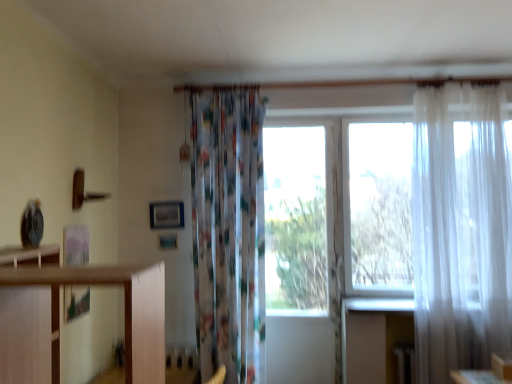
The image size is (512, 384). I want to click on transparent white curtain at right, so click(377, 208).

What do you see at coordinates (377, 208) in the screenshot?
I see `transparent white curtain at right` at bounding box center [377, 208].

Where is `printed fabric curtain at center, arranged as the 1th curtain when viewed from the left`? The height and width of the screenshot is (384, 512). printed fabric curtain at center, arranged as the 1th curtain when viewed from the left is located at coordinates coord(228,229).

The height and width of the screenshot is (384, 512). Identify the location of wooden shelf at left. (124, 308).

Image resolution: width=512 pixels, height=384 pixels. I want to click on transparent glass window at center, so click(295, 219).

I want to click on translucent white curtain at right, which is the 2th curtain from left to right, so click(460, 232).

Is transparent white curtain at right facing away from translucent white curtain at right, which is the 2th curtain from left to right?

Absolutely, transparent white curtain at right is directed away from translucent white curtain at right, which is the 2th curtain from left to right.

Does transparent white curtain at right have a larger size compared to translucent white curtain at right, the 1th curtain when ordered from right to left?

Actually, transparent white curtain at right might be smaller than translucent white curtain at right, the 1th curtain when ordered from right to left.

From the image's perspective, starting from the transparent white curtain at right, which curtain is the 1st one below? Please provide its 2D coordinates.

[(460, 232)]

Would you say wooden shelf at left is to the left or to the right of transparent white curtain at right in the picture?

Clearly, wooden shelf at left is on the left of transparent white curtain at right in the image.

Which of these two, wooden shelf at left or transparent white curtain at right, stands shorter?

wooden shelf at left.

Is wooden shelf at left surrounding transparent white curtain at right?

That's incorrect, transparent white curtain at right is not inside wooden shelf at left.

Can you confirm if wooden shelf at left is wider than transparent white curtain at right?

Indeed, wooden shelf at left has a greater width compared to transparent white curtain at right.

Can we say transparent white curtain at right lies outside printed fabric curtain at center, the second curtain positioned from the right?

That's correct, transparent white curtain at right is outside of printed fabric curtain at center, the second curtain positioned from the right.

From the image's perspective, is transparent white curtain at right over printed fabric curtain at center, the second curtain positioned from the right?

Yes, from the image's perspective, transparent white curtain at right is over printed fabric curtain at center, the second curtain positioned from the right.

What's the angular difference between transparent white curtain at right and printed fabric curtain at center, the second curtain positioned from the right,'s facing directions?

They differ by 1.27 degrees in their facing directions.

Does transparent white curtain at right turn towards printed fabric curtain at center, the second curtain positioned from the right?

No, transparent white curtain at right is not oriented towards printed fabric curtain at center, the second curtain positioned from the right.

Is the depth of printed fabric curtain at center, arranged as the 1th curtain when viewed from the left, less than that of wooden shelf at left?

No, the depth of printed fabric curtain at center, arranged as the 1th curtain when viewed from the left, is greater than that of wooden shelf at left.

Is wooden shelf at left inside printed fabric curtain at center, the second curtain positioned from the right?

No, printed fabric curtain at center, the second curtain positioned from the right, does not contain wooden shelf at left.

From a real-world perspective, is printed fabric curtain at center, arranged as the 1th curtain when viewed from the left, on top of wooden shelf at left?

Yes.

Between printed fabric curtain at center, arranged as the 1th curtain when viewed from the left, and wooden shelf at left, which one has larger size?

With larger size is wooden shelf at left.

Can you confirm if translucent white curtain at right, which is the 2th curtain from left to right, is shorter than transparent white curtain at right?

No, translucent white curtain at right, which is the 2th curtain from left to right, is not shorter than transparent white curtain at right.

Looking at this image, is translucent white curtain at right, the 1th curtain when ordered from right to left, oriented towards transparent white curtain at right?

Yes, translucent white curtain at right, the 1th curtain when ordered from right to left, faces towards transparent white curtain at right.

Is translucent white curtain at right, which is the 2th curtain from left to right, inside or outside of transparent white curtain at right?

translucent white curtain at right, which is the 2th curtain from left to right, lies outside transparent white curtain at right.

What's the angular difference between translucent white curtain at right, the 1th curtain when ordered from right to left, and transparent white curtain at right's facing directions?

The facing directions of translucent white curtain at right, the 1th curtain when ordered from right to left, and transparent white curtain at right are 1.27 degrees apart.

From a real-world perspective, between printed fabric curtain at center, the second curtain positioned from the right, and translucent white curtain at right, which is the 2th curtain from left to right, who is vertically higher?

translucent white curtain at right, which is the 2th curtain from left to right, from a real-world perspective.

Is printed fabric curtain at center, arranged as the 1th curtain when viewed from the left, far away from translucent white curtain at right, which is the 2th curtain from left to right?

Indeed, printed fabric curtain at center, arranged as the 1th curtain when viewed from the left, is not near translucent white curtain at right, which is the 2th curtain from left to right.

Could you measure the distance between printed fabric curtain at center, arranged as the 1th curtain when viewed from the left, and translucent white curtain at right, the 1th curtain when ordered from right to left?

printed fabric curtain at center, arranged as the 1th curtain when viewed from the left, is 1.34 meters from translucent white curtain at right, the 1th curtain when ordered from right to left.

Which object is positioned more to the right, printed fabric curtain at center, arranged as the 1th curtain when viewed from the left, or translucent white curtain at right, the 1th curtain when ordered from right to left?

translucent white curtain at right, the 1th curtain when ordered from right to left.

In the scene shown: Is translucent white curtain at right, which is the 2th curtain from left to right, to the left of printed fabric curtain at center, the second curtain positioned from the right, from the viewer's perspective?

No, translucent white curtain at right, which is the 2th curtain from left to right, is not to the left of printed fabric curtain at center, the second curtain positioned from the right.

Considering the points (441, 138) and (257, 157), which point is behind, point (441, 138) or point (257, 157)?

The point (257, 157) is farther.

From the image's perspective, is translucent white curtain at right, which is the 2th curtain from left to right, positioned above or below printed fabric curtain at center, arranged as the 1th curtain when viewed from the left?

Based on their image positions, translucent white curtain at right, which is the 2th curtain from left to right, is located above printed fabric curtain at center, arranged as the 1th curtain when viewed from the left.

At what (x,y) coordinates should I click in order to perform the action: click on the 1st curtain located beneath the transparent white curtain at right (from a real-world perspective). Please return your answer as a coordinate pair (x, y). Looking at the image, I should click on click(x=460, y=232).

Where is `window screen above the wooden shelf at left (from the image's perspective)`? window screen above the wooden shelf at left (from the image's perspective) is located at coordinates (377, 208).

Considering their positions, is printed fabric curtain at center, the second curtain positioned from the right, positioned closer to transparent white curtain at right than transparent glass window at center?

transparent glass window at center is closer to transparent white curtain at right.

Based on their spatial positions, is transparent white curtain at right or translucent white curtain at right, the 1th curtain when ordered from right to left, further from wooden shelf at left?

Based on the image, transparent white curtain at right appears to be further to wooden shelf at left.

From the image, which object appears to be nearer to translucent white curtain at right, the 1th curtain when ordered from right to left, transparent white curtain at right or printed fabric curtain at center, the second curtain positioned from the right?

Among the two, transparent white curtain at right is located nearer to translucent white curtain at right, the 1th curtain when ordered from right to left.

Which object lies further to the anchor point transparent white curtain at right, translucent white curtain at right, the 1th curtain when ordered from right to left, or transparent glass window at center?

translucent white curtain at right, the 1th curtain when ordered from right to left, is further to transparent white curtain at right.

Which object lies further to the anchor point transparent white curtain at right, wooden shelf at left or printed fabric curtain at center, the second curtain positioned from the right?

wooden shelf at left.

From the picture: Considering their positions, is translucent white curtain at right, the 1th curtain when ordered from right to left, positioned closer to transparent white curtain at right than printed fabric curtain at center, the second curtain positioned from the right?

translucent white curtain at right, the 1th curtain when ordered from right to left, lies closer to transparent white curtain at right than the other object.

Considering their positions, is wooden shelf at left positioned closer to printed fabric curtain at center, arranged as the 1th curtain when viewed from the left, than translucent white curtain at right, the 1th curtain when ordered from right to left?

translucent white curtain at right, the 1th curtain when ordered from right to left.

From the picture: Looking at the image, which one is located closer to translucent white curtain at right, which is the 2th curtain from left to right, printed fabric curtain at center, the second curtain positioned from the right, or transparent glass window at center?

transparent glass window at center is positioned closer to the anchor translucent white curtain at right, which is the 2th curtain from left to right.

At what (x,y) coordinates should I click in order to perform the action: click on curtain located between wooden shelf at left and printed fabric curtain at center, the second curtain positioned from the right, in the depth direction. Please return your answer as a coordinate pair (x, y). The height and width of the screenshot is (384, 512). Looking at the image, I should click on (460, 232).

Locate an element on the screen. The height and width of the screenshot is (384, 512). window between printed fabric curtain at center, the second curtain positioned from the right, and translucent white curtain at right, the 1th curtain when ordered from right to left is located at coordinates (295, 219).

Identify the location of window screen between transparent glass window at center and translucent white curtain at right, the 1th curtain when ordered from right to left, from left to right. (377, 208).

In order to click on window screen between wooden shelf at left and transparent glass window at center in the front-back direction in this screenshot , I will do `click(377, 208)`.